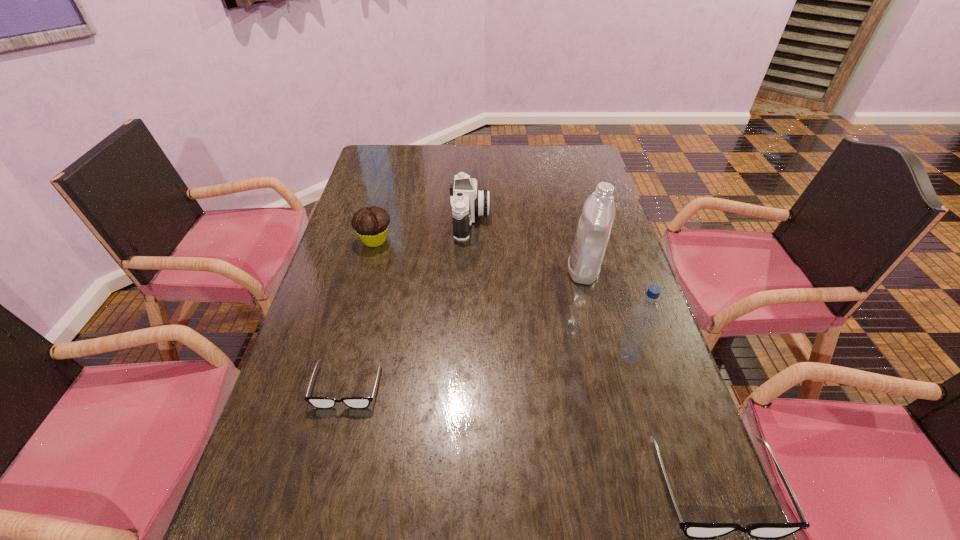
The width and height of the screenshot is (960, 540). What are the coordinates of `vacant space that satisfies the following two spatial constraints: 1. on the front side of the fourth shortest object; 2. on the right side of the detergent` in the screenshot? It's located at (468, 270).